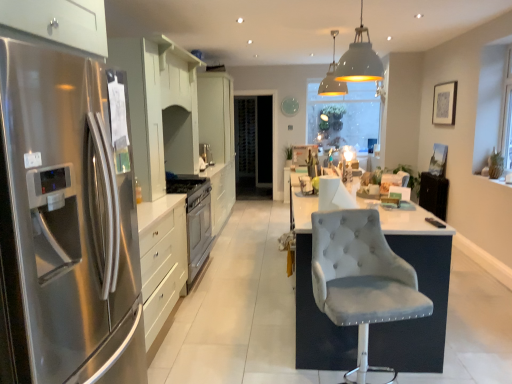
Question: Does white glossy cabinets at center appear on the left side of stainless steel refrigerator at left?

Choices:
 (A) yes
 (B) no

Answer: (B)

Question: Is white glossy cabinets at center closer to camera compared to stainless steel refrigerator at left?

Choices:
 (A) yes
 (B) no

Answer: (B)

Question: Can you confirm if white glossy cabinets at center is taller than stainless steel refrigerator at left?

Choices:
 (A) yes
 (B) no

Answer: (A)

Question: Can you confirm if white glossy cabinets at center is bigger than stainless steel refrigerator at left?

Choices:
 (A) no
 (B) yes

Answer: (B)

Question: Is white glossy cabinets at center outside stainless steel refrigerator at left?

Choices:
 (A) yes
 (B) no

Answer: (A)

Question: From the image's perspective, relative to velvet grey chair at center, is stainless steel refrigerator at left above or below?

Choices:
 (A) above
 (B) below

Answer: (A)

Question: Considering the positions of stainless steel refrigerator at left and velvet grey chair at center in the image, is stainless steel refrigerator at left taller or shorter than velvet grey chair at center?

Choices:
 (A) short
 (B) tall

Answer: (B)

Question: Is point (x=18, y=74) positioned closer to the camera than point (x=376, y=307)?

Choices:
 (A) farther
 (B) closer

Answer: (B)

Question: From a real-world perspective, is stainless steel refrigerator at left above or below velvet grey chair at center?

Choices:
 (A) above
 (B) below

Answer: (A)

Question: From the image's perspective, is transparent glass window screen at center above or below matte white pendant lamp at upper center, the 2th light fixture positioned from the front?

Choices:
 (A) above
 (B) below

Answer: (B)

Question: Does point (375, 97) appear closer or farther from the camera than point (324, 89)?

Choices:
 (A) farther
 (B) closer

Answer: (A)

Question: Considering the positions of transparent glass window screen at center and matte white pendant lamp at upper center, the 1th light fixture when ordered from back to front, in the image, is transparent glass window screen at center bigger or smaller than matte white pendant lamp at upper center, the 1th light fixture when ordered from back to front,?

Choices:
 (A) small
 (B) big

Answer: (B)

Question: Would you say transparent glass window screen at center is inside or outside matte white pendant lamp at upper center, the 2th light fixture positioned from the front?

Choices:
 (A) outside
 (B) inside

Answer: (A)

Question: Considering the positions of stainless steel refrigerator at left and white glossy cabinets at center in the image, is stainless steel refrigerator at left wider or thinner than white glossy cabinets at center?

Choices:
 (A) thin
 (B) wide

Answer: (B)

Question: Relative to white glossy cabinets at center, is stainless steel refrigerator at left in front or behind?

Choices:
 (A) behind
 (B) front

Answer: (B)